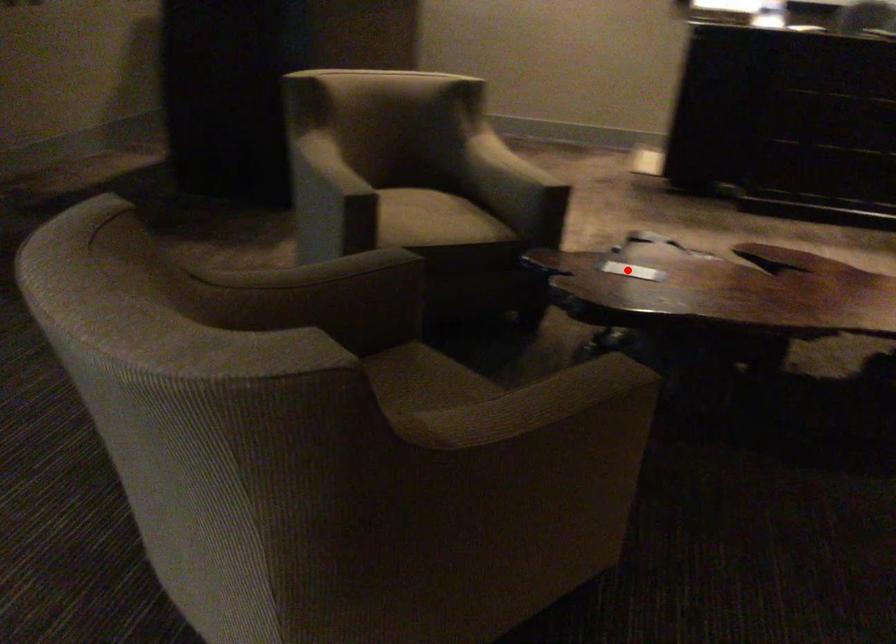
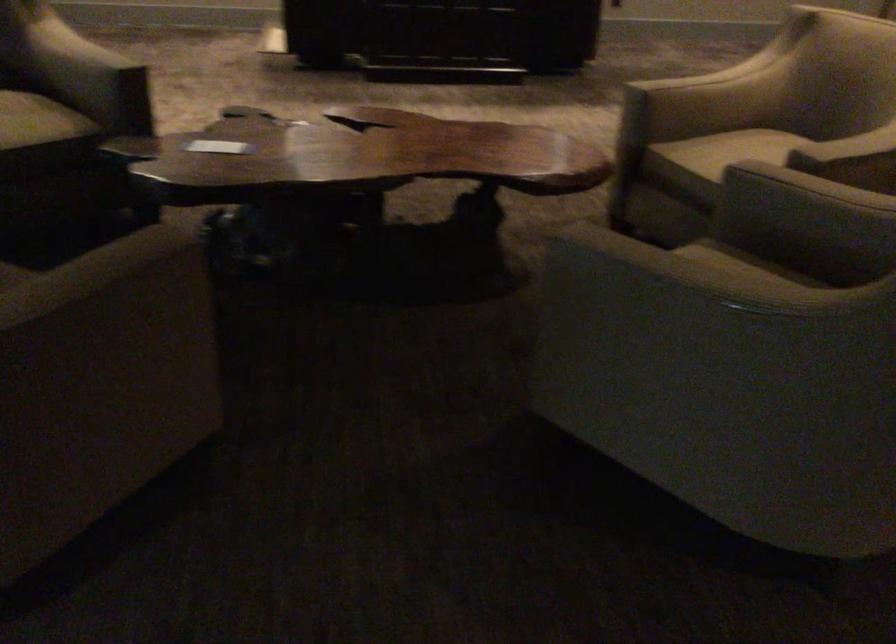
In the second image, find the point that corresponds to the highlighted location in the first image.

(218, 146)